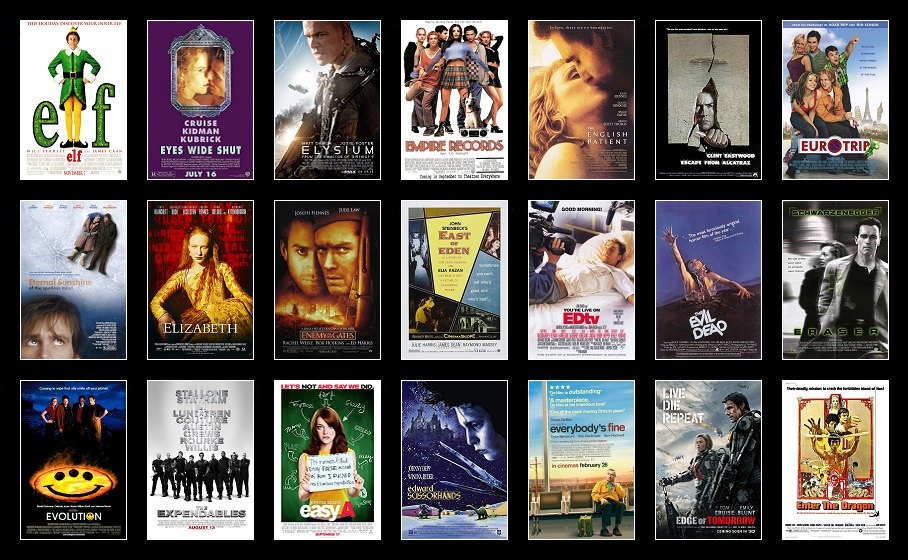
Locate an element on the screen. The width and height of the screenshot is (908, 560). posters in the bottom row is located at coordinates (64, 459), (204, 456), (358, 451), (468, 446), (587, 447), (696, 447), (842, 451).